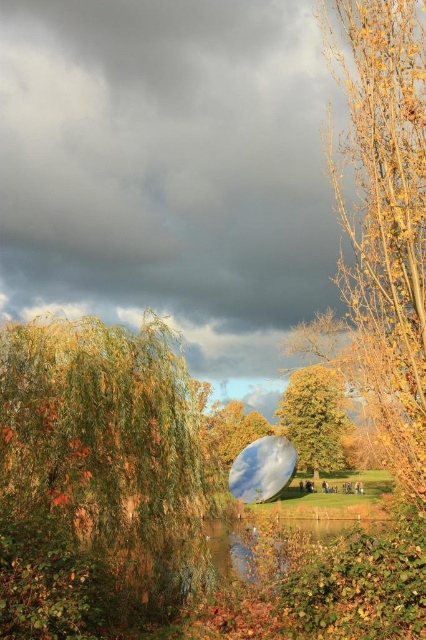
You are an artist planning to paint the scene. You want to ensure the golden textured tree at center and the transparent glass bubble at center are proportionate to their real sizes. According to the scene, which object should you draw smaller?

The golden textured tree at center should be drawn smaller because it has a lesser height compared to the transparent glass bubble at center.

You are an artist planning to paint the scene. You want to ensure the golden textured tree at center and transparent glass water at center are proportionally accurate. Which object should you paint first if you want to start with the larger one?

You should start with the transparent glass water at center because the golden textured tree at center is smaller than it according to the description.